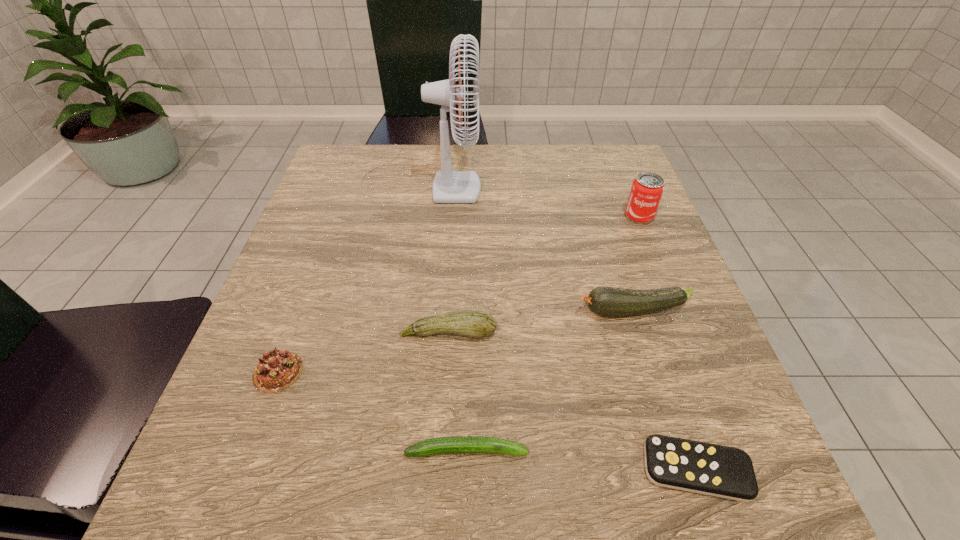
Where is `unoccupied position between the chocolate cake and the tallest object`? The height and width of the screenshot is (540, 960). unoccupied position between the chocolate cake and the tallest object is located at coordinates (349, 275).

You are a GUI agent. You are given a task and a screenshot of the screen. Output one action in this format:
    pyautogui.click(x=<x>, y=<y>)
    Task: Click on the vacant space in between the can and the chocolate cake
    The width and height of the screenshot is (960, 540).
    Given the screenshot: What is the action you would take?
    pyautogui.click(x=459, y=294)

Find the location of a particular element. The image size is (960, 540). object that stands as the third closest to the can is located at coordinates (473, 323).

Identify which object is located as the fourth nearest to the remote control. Please provide its 2D coordinates. Your answer should be formatted as a tuple, i.e. [(x, y)], where the tuple contains the x and y coordinates of a point satisfying the conditions above.

[(647, 189)]

Find the location of a particular element. zucchini that is the second closest to the remote control is located at coordinates (606, 301).

In order to click on the second closest zucchini to the third nearest object in this screenshot , I will do `click(458, 444)`.

I want to click on vacant space that satisfies the following two spatial constraints: 1. at the blossom end of the rightmost zucchini; 2. at the stem end of the second tallest zucchini, so click(639, 333).

You are a GUI agent. You are given a task and a screenshot of the screen. Output one action in this format:
    pyautogui.click(x=<x>, y=<y>)
    Task: Click on the free space that satisfies the following two spatial constraints: 1. on the front side of the can; 2. on the front-facing side of the nearest zucchini
    The image size is (960, 540).
    Given the screenshot: What is the action you would take?
    pyautogui.click(x=733, y=450)

You are a GUI agent. You are given a task and a screenshot of the screen. Output one action in this format:
    pyautogui.click(x=<x>, y=<y>)
    Task: Click on the vacant region that satisfies the following two spatial constraints: 1. on the front side of the sixth shortest object; 2. at the blossom end of the rightmost zucchini
    
    Given the screenshot: What is the action you would take?
    pyautogui.click(x=678, y=311)

You are a GUI agent. You are given a task and a screenshot of the screen. Output one action in this format:
    pyautogui.click(x=<x>, y=<y>)
    Task: Click on the blank area in the image that satisfies the following two spatial constraints: 1. on the front-facing side of the fan; 2. on the right side of the remote control
    The image size is (960, 540).
    Given the screenshot: What is the action you would take?
    pyautogui.click(x=373, y=469)